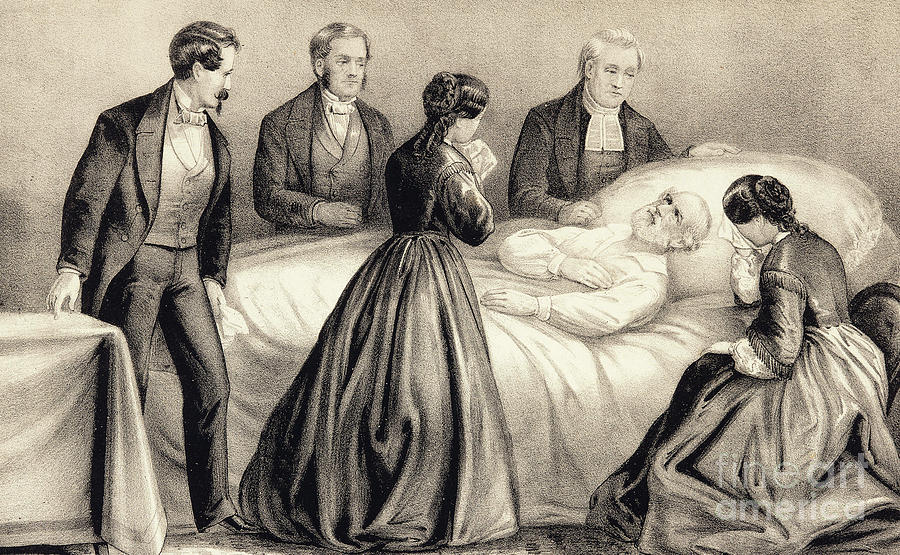
Identify the location of foldable seat. (867, 325).